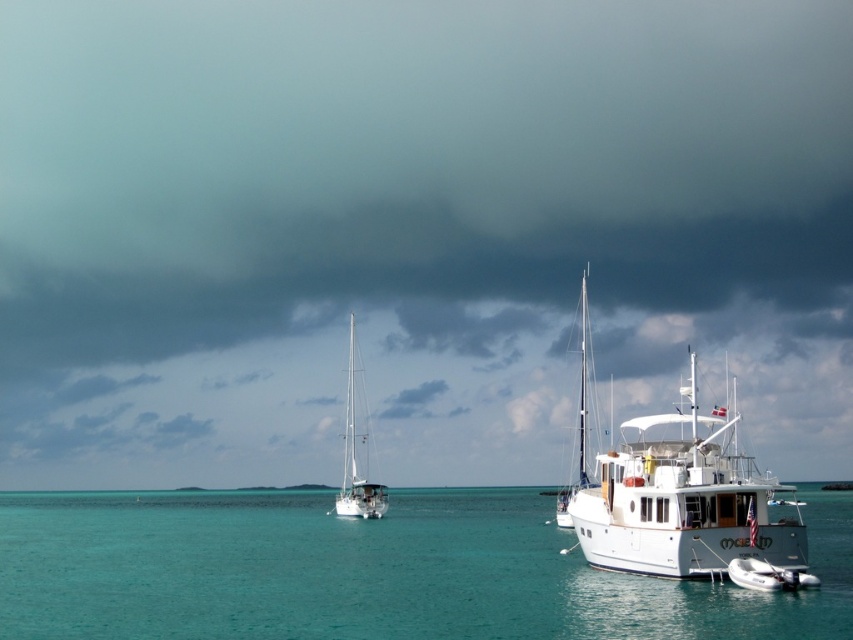
Measure the distance between white glossy sailboat at right and camera.

white glossy sailboat at right and camera are 136.87 feet apart.

Is white glossy sailboat at right above white glossy sailboat at center?

Correct, white glossy sailboat at right is located above white glossy sailboat at center.

Where is `white glossy sailboat at right`? white glossy sailboat at right is located at coordinates (581, 412).

This screenshot has width=853, height=640. In order to click on white glossy sailboat at right in this screenshot , I will do click(x=581, y=412).

Between point (93, 616) and point (583, 342), which one is positioned behind?

The point (583, 342) is behind.

Is point (456, 529) farther from camera compared to point (584, 273)?

No, it is not.

Where is `turquoise water at center`? turquoise water at center is located at coordinates (368, 572).

Does turquoise water at center have a lesser height compared to white matte boat at lower right?

No, turquoise water at center is not shorter than white matte boat at lower right.

Locate an element on the screen. This screenshot has height=640, width=853. turquoise water at center is located at coordinates tap(368, 572).